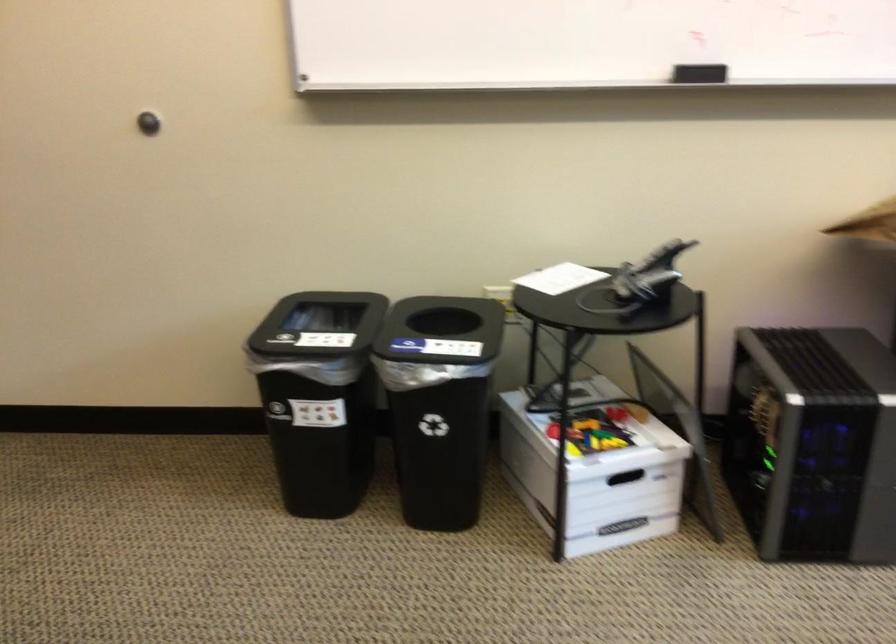
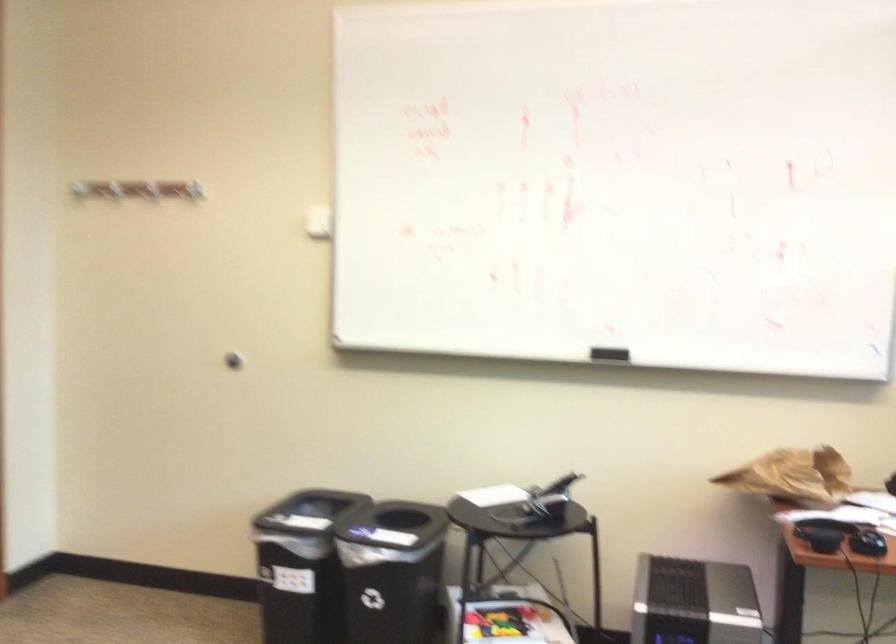
The point at [702,75] is marked in the first image. Where is the corresponding point in the second image?

(608, 354)